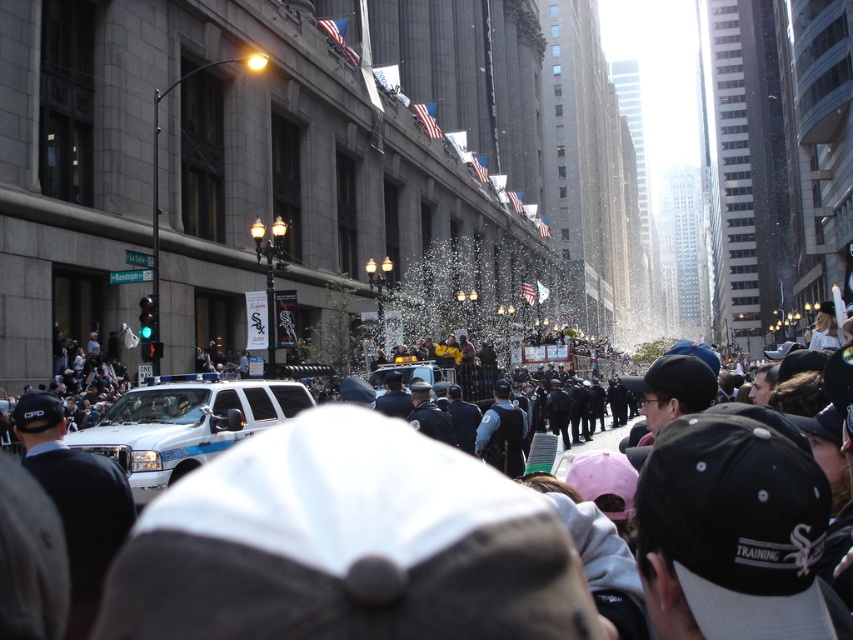
Based on the photo, you are a photographer trying to capture the police car in the city scene. You notice the shiny metallic confetti at center and the white glossy police car at center. Which object is positioned higher in the image?

The shiny metallic confetti at center is much taller than the white glossy police car at center, so it is positioned higher in the image.

You are standing at the point with coordinates point (457,282) and want to walk to the point with coordinates point (193,384). According to the scene, which direction should you move to reach your destination?

Point (193,384) is in front of point (457,282), so you should move forward to reach the destination.